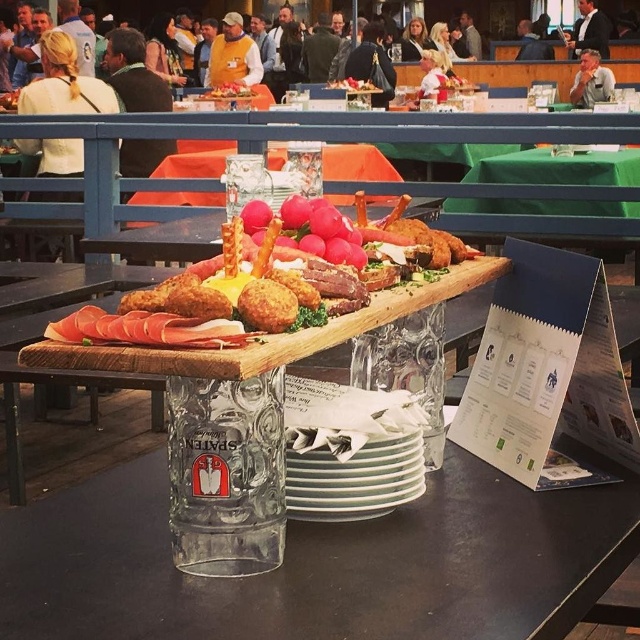
Question: Can you confirm if transparent glass at center is wider than wooden board at center?

Choices:
 (A) yes
 (B) no

Answer: (A)

Question: Can you confirm if transparent glass at center is positioned below wooden board at center?

Choices:
 (A) yes
 (B) no

Answer: (A)

Question: Which of the following is the closest to the observer?

Choices:
 (A) (360, 205)
 (B) (118, 536)

Answer: (B)

Question: Can you confirm if transparent glass at center is positioned to the right of smooth wooden board at center?

Choices:
 (A) yes
 (B) no

Answer: (A)

Question: Which object is the closest to the wooden board at center?

Choices:
 (A) transparent glass at center
 (B) smooth wooden board at center

Answer: (A)

Question: Which point is farther from the camera taking this photo?

Choices:
 (A) pyautogui.click(x=211, y=250)
 (B) pyautogui.click(x=163, y=452)

Answer: (A)